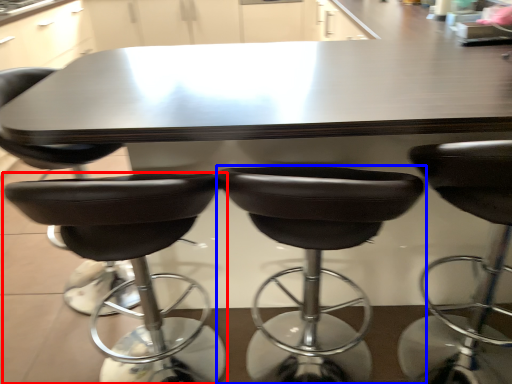
Question: Among these objects, which one is farthest to the camera, chair (highlighted by a red box) or chair (highlighted by a blue box)?

Choices:
 (A) chair
 (B) chair

Answer: (A)